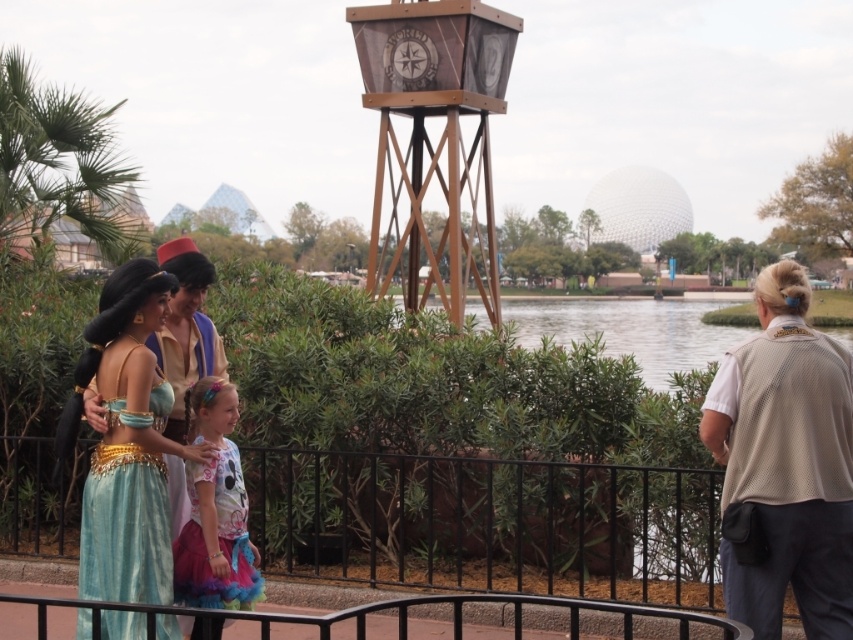
You are a photographer trying to capture a clear shot of the black metal fence at lower center and the beige mesh vest at right. Since you want both objects to be visible in the frame, will the size difference between them cause any issues with framing?

The black metal fence at lower center is larger in size than the beige mesh vest at right, so the fence will take up more space in the frame. However, since the vest is smaller, it can still be included in the shot without overlapping, provided the camera is positioned appropriately to accommodate both sizes.

You are a photographer trying to capture the pastel floral dress at center and the black metal fence at lower center in the same frame. Which object should you focus on first to ensure both are in the shot?

You should focus on the black metal fence at lower center first because it is positioned under the pastel floral dress at center, so adjusting the camera to include the lower object will naturally include the dress above it.